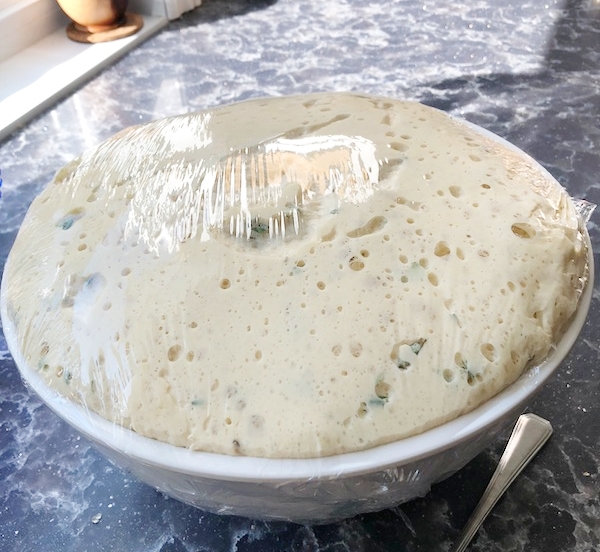
Where is `table`? The image size is (600, 552). table is located at coordinates (583, 390).